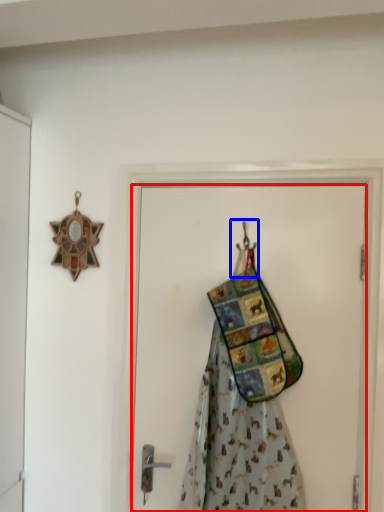
Question: Which object is closer to the camera taking this photo, door (highlighted by a red box) or hanger (highlighted by a blue box)?

Choices:
 (A) door
 (B) hanger

Answer: (A)